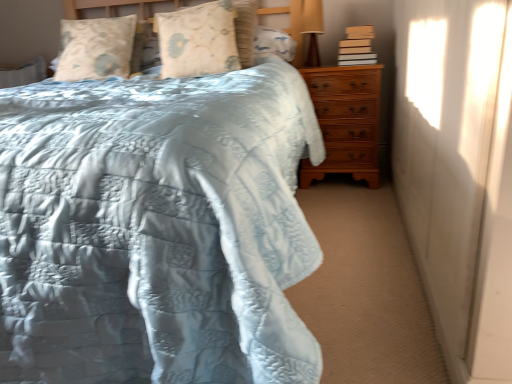
Question: From the image's perspective, would you say brown wooden chest of drawers at right is shown under light blue quilted bed at center?

Choices:
 (A) no
 (B) yes

Answer: (A)

Question: Considering the relative positions of brown wooden chest of drawers at right and light blue quilted bed at center in the image provided, is brown wooden chest of drawers at right to the left of light blue quilted bed at center from the viewer's perspective?

Choices:
 (A) yes
 (B) no

Answer: (B)

Question: Is brown wooden chest of drawers at right outside light blue quilted bed at center?

Choices:
 (A) yes
 (B) no

Answer: (B)

Question: Does brown wooden chest of drawers at right appear on the right side of light blue quilted bed at center?

Choices:
 (A) no
 (B) yes

Answer: (B)

Question: Is brown wooden chest of drawers at right positioned before light blue quilted bed at center?

Choices:
 (A) yes
 (B) no

Answer: (B)

Question: Does point (304, 9) appear closer or farther from the camera than point (113, 89)?

Choices:
 (A) farther
 (B) closer

Answer: (A)

Question: In terms of width, does matte brown table lamp at upper right look wider or thinner when compared to light blue quilted bed at center?

Choices:
 (A) wide
 (B) thin

Answer: (B)

Question: Is matte brown table lamp at upper right to the left or to the right of light blue quilted bed at center in the image?

Choices:
 (A) left
 (B) right

Answer: (B)

Question: Based on their sizes in the image, would you say matte brown table lamp at upper right is bigger or smaller than light blue quilted bed at center?

Choices:
 (A) big
 (B) small

Answer: (B)

Question: Considering the positions of brown wooden chest of drawers at right and floral-patterned fabric pillow at upper center, positioned as the first pillow in right-to-left order, in the image, is brown wooden chest of drawers at right wider or thinner than floral-patterned fabric pillow at upper center, positioned as the first pillow in right-to-left order,?

Choices:
 (A) wide
 (B) thin

Answer: (A)

Question: From the image's perspective, is brown wooden chest of drawers at right located above or below floral-patterned fabric pillow at upper center, positioned as the first pillow in right-to-left order?

Choices:
 (A) above
 (B) below

Answer: (B)

Question: Considering the positions of brown wooden chest of drawers at right and floral-patterned fabric pillow at upper center, the 2th pillow positioned from the left, in the image, is brown wooden chest of drawers at right taller or shorter than floral-patterned fabric pillow at upper center, the 2th pillow positioned from the left,?

Choices:
 (A) tall
 (B) short

Answer: (A)

Question: Would you say brown wooden chest of drawers at right is to the left or to the right of floral-patterned fabric pillow at upper center, positioned as the first pillow in right-to-left order, in the picture?

Choices:
 (A) right
 (B) left

Answer: (A)

Question: Looking at their shapes, would you say light blue quilted bed at center is wider or thinner than white matte curtain at right?

Choices:
 (A) wide
 (B) thin

Answer: (A)

Question: In the image, is light blue quilted bed at center positioned in front of or behind white matte curtain at right?

Choices:
 (A) front
 (B) behind

Answer: (A)